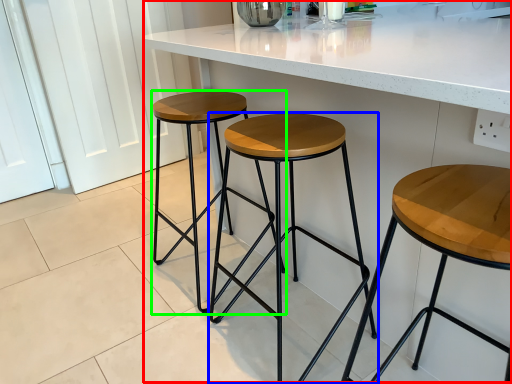
Question: Which is farther away from counter (highlighted by a red box)? stool (highlighted by a blue box) or stool (highlighted by a green box)?

Choices:
 (A) stool
 (B) stool

Answer: (B)